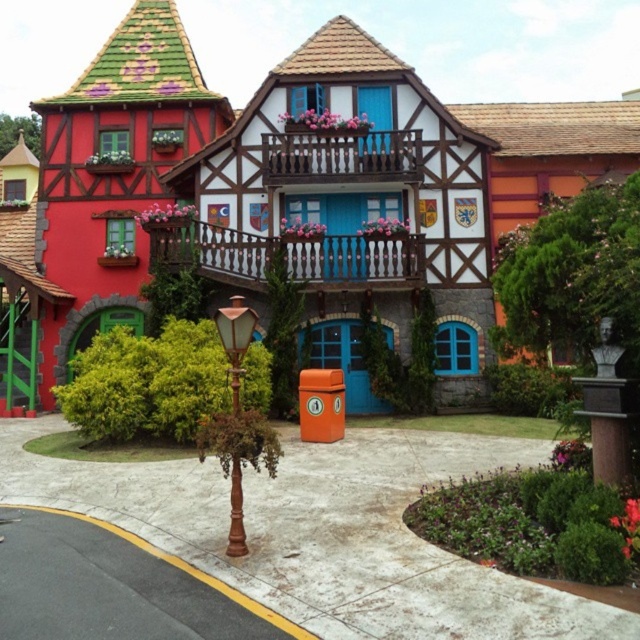
Can you confirm if wooden balcony at center is positioned below wooden lamp post at center?

Actually, wooden balcony at center is above wooden lamp post at center.

Can you confirm if wooden balcony at center is wider than wooden lamp post at center?

Yes, wooden balcony at center is wider than wooden lamp post at center.

This screenshot has height=640, width=640. What are the coordinates of `wooden balcony at center` in the screenshot? It's located at (288, 253).

I want to click on wooden balcony at center, so (288, 253).

Who is taller, wooden at upper center or wooden lamp post at center?

With more height is wooden at upper center.

Is point (275, 134) positioned before point (236, 305)?

No, it is behind (236, 305).

The image size is (640, 640). In order to click on wooden at upper center in this screenshot , I will do `click(340, 156)`.

Between wooden balcony at center and wooden at upper center, which one appears on the left side from the viewer's perspective?

wooden at upper center

Which of these two, wooden balcony at center or wooden at upper center, stands shorter?

→ wooden balcony at center

The width and height of the screenshot is (640, 640). In order to click on wooden balcony at center in this screenshot , I will do `click(288, 253)`.